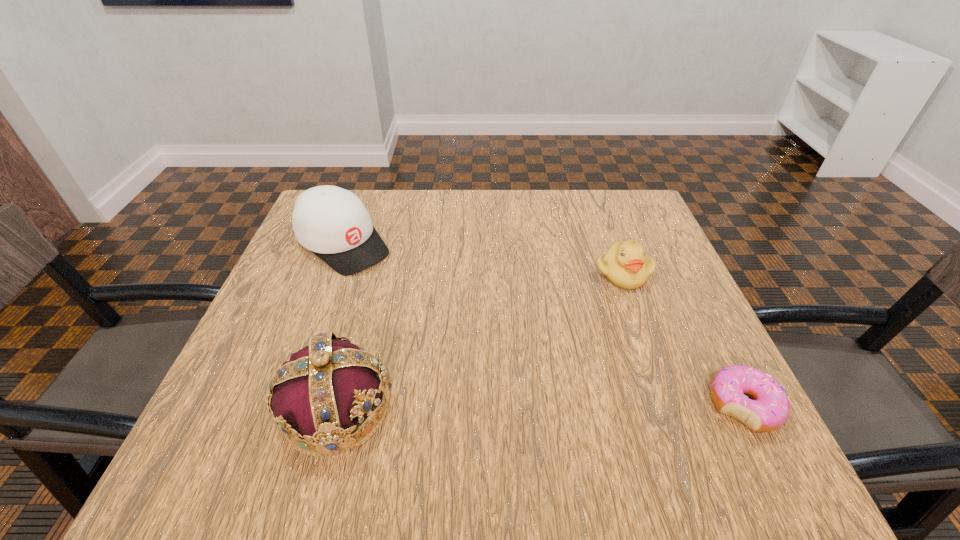
Where is `free space located on the front-facing side of the baseball cap`? Image resolution: width=960 pixels, height=540 pixels. free space located on the front-facing side of the baseball cap is located at coordinates (468, 342).

Find the location of a particular element. The width and height of the screenshot is (960, 540). free space located on the front-facing side of the second shortest object is located at coordinates (591, 335).

Find the location of a particular element. vacant space situated on the front-facing side of the second shortest object is located at coordinates (569, 380).

At what (x,y) coordinates should I click in order to perform the action: click on free region located 0.320m on the front-facing side of the second shortest object. Please return your answer as a coordinate pair (x, y). Looking at the image, I should click on (559, 401).

You are a GUI agent. You are given a task and a screenshot of the screen. Output one action in this format:
    pyautogui.click(x=<x>, y=<y>)
    Task: Click on the object that is at the far edge
    This screenshot has width=960, height=540.
    Given the screenshot: What is the action you would take?
    pyautogui.click(x=333, y=223)

The width and height of the screenshot is (960, 540). Identify the location of crown located in the near edge section of the desktop. (x=319, y=395).

Where is `doughnut at the near edge`? doughnut at the near edge is located at coordinates (769, 410).

Locate an element on the screen. The height and width of the screenshot is (540, 960). crown at the left edge is located at coordinates (319, 395).

The width and height of the screenshot is (960, 540). Identify the location of baseball cap that is at the left edge. (333, 223).

The image size is (960, 540). What are the coordinates of `doughnut that is at the right edge` in the screenshot? It's located at (769, 410).